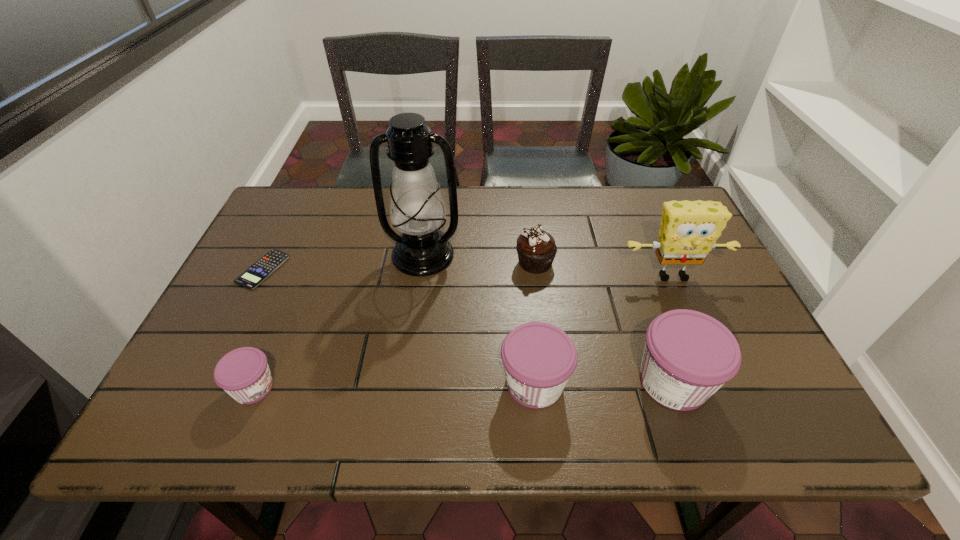
Locate an element on the screen. The image size is (960, 540). the leftmost jam is located at coordinates (243, 373).

Locate an element on the screen. the shortest jam is located at coordinates (243, 373).

The height and width of the screenshot is (540, 960). Find the location of `the second shortest jam`. the second shortest jam is located at coordinates (539, 358).

At what (x,y) coordinates should I click in order to perform the action: click on the rightmost jam. Please return your answer as a coordinate pair (x, y). Looking at the image, I should click on (688, 355).

Find the location of a particular element. cupcake is located at coordinates (536, 248).

What are the coordinates of `oil lamp` in the screenshot? It's located at (417, 210).

Find the location of a particular element. This screenshot has height=540, width=960. the fifth object from right to left is located at coordinates (417, 210).

What are the coordinates of `sponge` in the screenshot? It's located at (689, 229).

Find the location of a particular element. the shortest object is located at coordinates (258, 272).

I want to click on vacant region located 0.090m on the front label of the shortest jam, so click(320, 388).